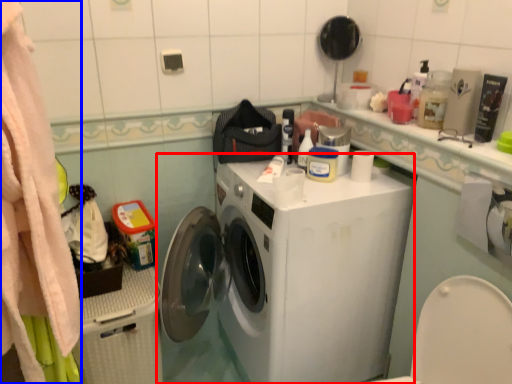
Question: Which of the following is the farthest to the observer, washing machine (highlighted by a red box) or clothing (highlighted by a blue box)?

Choices:
 (A) washing machine
 (B) clothing

Answer: (A)